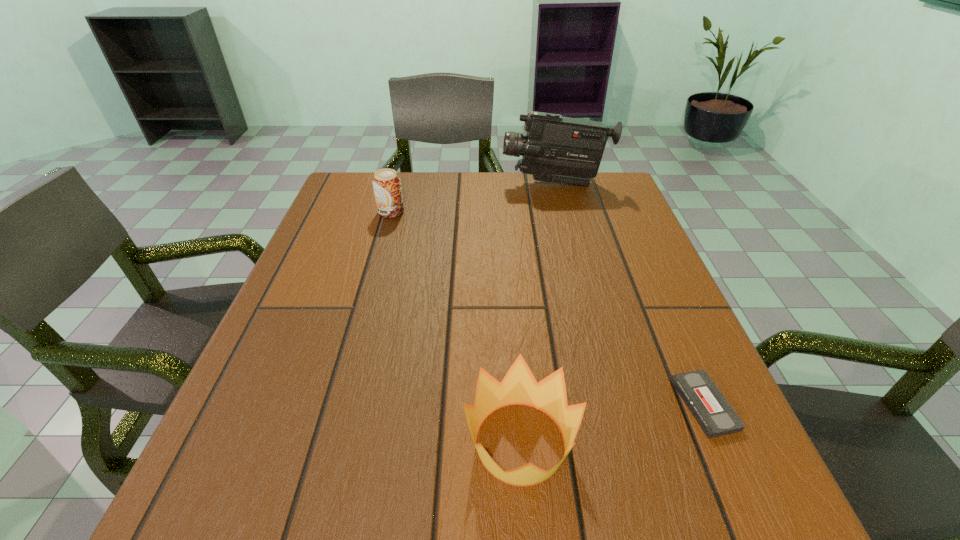
This screenshot has height=540, width=960. I want to click on vacant space that's between the camcorder and the crown, so click(x=538, y=313).

Identify the location of vacant area that lies between the videotape and the tallest object. (630, 294).

This screenshot has width=960, height=540. Identify the location of free point between the camcorder and the crown. (538, 313).

Locate an element on the screen. empty space that is in between the shortest object and the crown is located at coordinates (612, 423).

Identify the location of vacant point located between the crown and the camcorder. The width and height of the screenshot is (960, 540). (538, 313).

Locate which object is the second closest to the tallest object. Please provide its 2D coordinates. Your answer should be formatted as a tuple, i.e. [(x, y)], where the tuple contains the x and y coordinates of a point satisfying the conditions above.

[(713, 413)]

Locate which object ranks in proximity to the crown. Please provide its 2D coordinates. Your answer should be formatted as a tuple, i.e. [(x, y)], where the tuple contains the x and y coordinates of a point satisfying the conditions above.

[(713, 413)]

Where is `free space that satisfies the following two spatial constraints: 1. on the front-facing side of the tallest object; 2. on the front side of the leftmost object`? Image resolution: width=960 pixels, height=540 pixels. free space that satisfies the following two spatial constraints: 1. on the front-facing side of the tallest object; 2. on the front side of the leftmost object is located at coordinates (563, 212).

Image resolution: width=960 pixels, height=540 pixels. I want to click on free location that satisfies the following two spatial constraints: 1. on the front-facing side of the tallest object; 2. on the right side of the videotape, so click(612, 404).

I want to click on free point that satisfies the following two spatial constraints: 1. on the front-facing side of the videotape; 2. on the right side of the farthest object, so click(x=612, y=404).